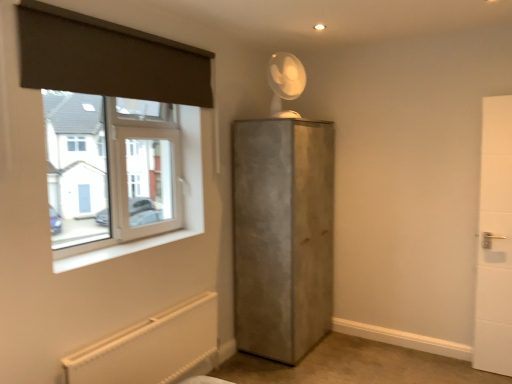
Question: From a real-world perspective, is dark gray fabric at upper left located higher than white plastic window at upper left?

Choices:
 (A) yes
 (B) no

Answer: (A)

Question: Does dark gray fabric at upper left appear on the right side of white plastic window at upper left?

Choices:
 (A) yes
 (B) no

Answer: (A)

Question: From a real-world perspective, is dark gray fabric at upper left under white plastic window at upper left?

Choices:
 (A) no
 (B) yes

Answer: (A)

Question: Does dark gray fabric at upper left have a larger size compared to white plastic window at upper left?

Choices:
 (A) yes
 (B) no

Answer: (B)

Question: Could you tell me if dark gray fabric at upper left is turned towards white plastic window at upper left?

Choices:
 (A) no
 (B) yes

Answer: (A)

Question: Is transparent plastic fan at upper center to the left or to the right of white smooth window sill at lower left in the image?

Choices:
 (A) left
 (B) right

Answer: (B)

Question: In the image, is transparent plastic fan at upper center positioned in front of or behind white smooth window sill at lower left?

Choices:
 (A) behind
 (B) front

Answer: (A)

Question: Is transparent plastic fan at upper center spatially inside white smooth window sill at lower left, or outside of it?

Choices:
 (A) outside
 (B) inside

Answer: (A)

Question: From a real-world perspective, is transparent plastic fan at upper center above or below white smooth window sill at lower left?

Choices:
 (A) above
 (B) below

Answer: (A)

Question: Is point (26, 59) positioned closer to the camera than point (479, 291)?

Choices:
 (A) closer
 (B) farther

Answer: (A)

Question: From the image's perspective, is dark gray fabric at upper left located above or below white tile door at right, which is the 2th door from left to right?

Choices:
 (A) below
 (B) above

Answer: (B)

Question: From a real-world perspective, relative to white tile door at right, which is the 2th door from left to right, is dark gray fabric at upper left vertically above or below?

Choices:
 (A) above
 (B) below

Answer: (A)

Question: Considering the positions of dark gray fabric at upper left and white tile door at right, which is the 1th door in right-to-left order, in the image, is dark gray fabric at upper left wider or thinner than white tile door at right, which is the 1th door in right-to-left order,?

Choices:
 (A) wide
 (B) thin

Answer: (B)

Question: In terms of width, does white smooth window sill at lower left look wider or thinner when compared to white textured radiator at lower left?

Choices:
 (A) thin
 (B) wide

Answer: (B)

Question: Is point (140, 249) closer or farther from the camera than point (207, 301)?

Choices:
 (A) farther
 (B) closer

Answer: (B)